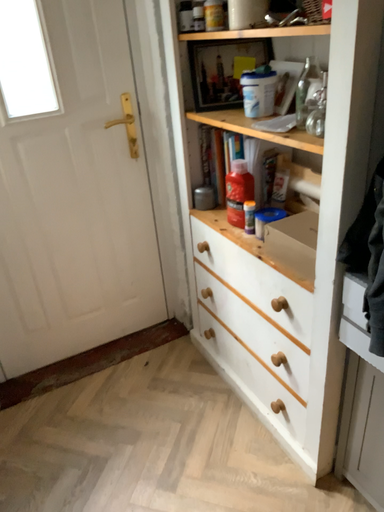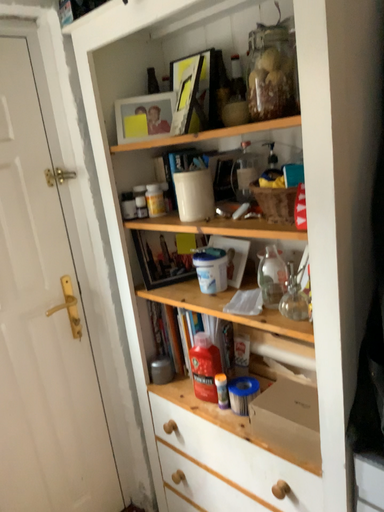
Question: Which way did the camera rotate in the video?

Choices:
 (A) rotated right
 (B) rotated left

Answer: (A)